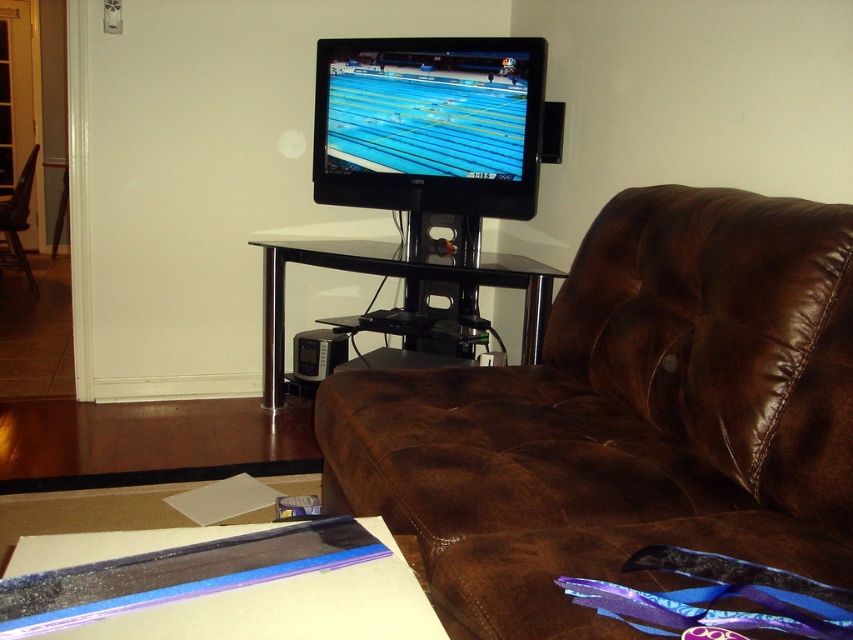
Question: Observing the image, what is the correct spatial positioning of brown leather couch at center in reference to translucent plastic flat at lower left?

Choices:
 (A) above
 (B) below

Answer: (A)

Question: Is matte black tv at center wider than translucent plastic flat at lower left?

Choices:
 (A) no
 (B) yes

Answer: (B)

Question: Is brown leather couch at center to the right of translucent plastic flat at lower left from the viewer's perspective?

Choices:
 (A) yes
 (B) no

Answer: (A)

Question: Which is farther from the matte black tv at center?

Choices:
 (A) brown leather couch at center
 (B) black plastic chair at left
 (C) black glass entertainment center at center

Answer: (B)

Question: Which point is closer to the camera taking this photo?

Choices:
 (A) (415, 65)
 (B) (4, 212)
 (C) (57, 552)
 (D) (518, 508)

Answer: (C)

Question: Considering the real-world distances, which object is closest to the translucent plastic flat at lower left?

Choices:
 (A) matte black tv at center
 (B) brown leather couch at center
 (C) black glass entertainment center at center
 (D) black plastic chair at left

Answer: (B)